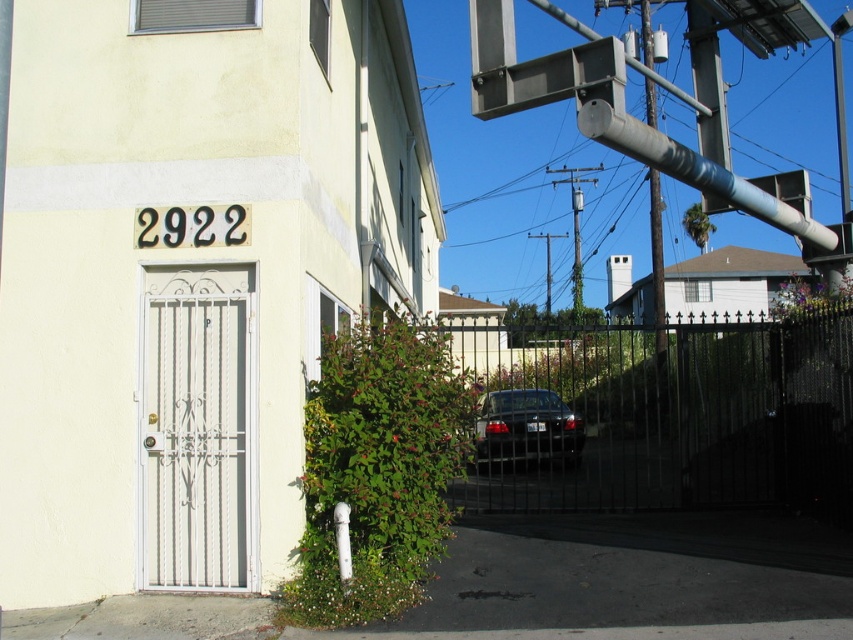
Is black wrought iron gate at center wider than shiny black sedan at center?

Correct, the width of black wrought iron gate at center exceeds that of shiny black sedan at center.

Who is shorter, black wrought iron gate at center or shiny black sedan at center?

With less height is shiny black sedan at center.

Is point (550, 387) positioned in front of point (544, 444)?

No, it is not.

At what (x,y) coordinates should I click in order to perform the action: click on black wrought iron gate at center. Please return your answer as a coordinate pair (x, y). The image size is (853, 640). Looking at the image, I should click on (666, 417).